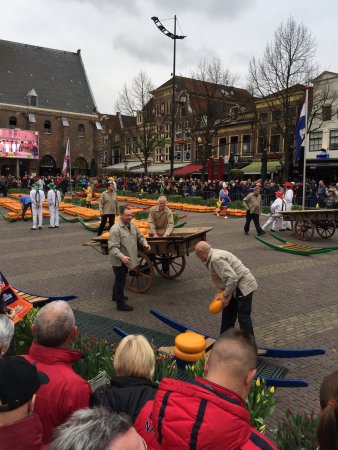
The height and width of the screenshot is (450, 338). In order to click on floor in this screenshot , I will do `click(64, 274)`.